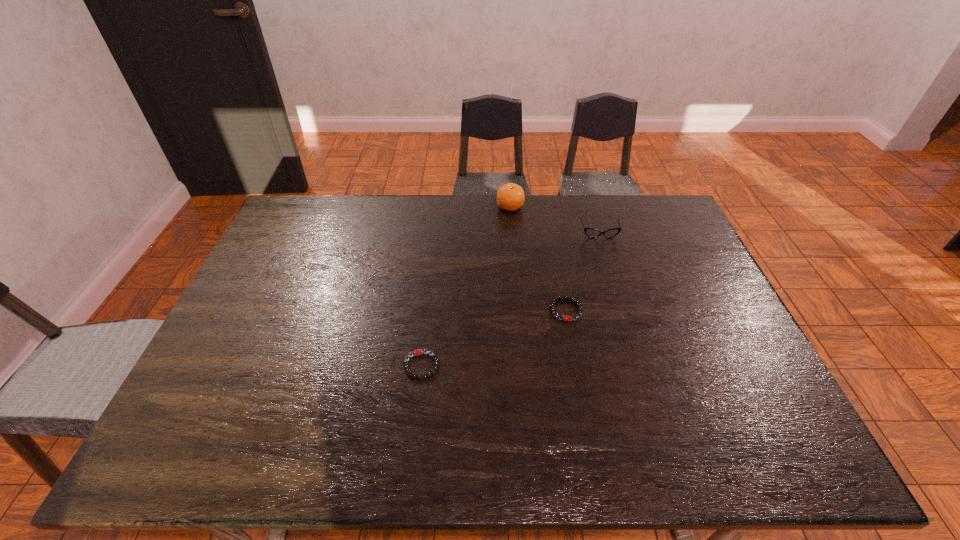
Locate an element on the screen. The image size is (960, 540). vacant space that's between the farthest object and the farther bracelet is located at coordinates (538, 258).

The image size is (960, 540). I want to click on free space between the nearest object and the tallest object, so click(466, 286).

At what (x,y) coordinates should I click in order to perform the action: click on vacant space that's between the farthest object and the spectacles. Please return your answer as a coordinate pair (x, y). This screenshot has width=960, height=540. Looking at the image, I should click on (555, 220).

I want to click on free spot between the right bracelet and the left bracelet, so click(x=493, y=338).

Image resolution: width=960 pixels, height=540 pixels. What are the coordinates of `free point between the second nearest object and the left bracelet` in the screenshot? It's located at (493, 338).

Identify the location of free space between the left bracelet and the second tallest object. The height and width of the screenshot is (540, 960). (511, 299).

The image size is (960, 540). What are the coordinates of `vacant region between the third object from right to left and the leftmost object` in the screenshot? It's located at (466, 286).

You are a GUI agent. You are given a task and a screenshot of the screen. Output one action in this format:
    pyautogui.click(x=<x>, y=<y>)
    Task: Click on the vacant space in between the nearer bracelet and the farther bracelet
    
    Given the screenshot: What is the action you would take?
    pyautogui.click(x=493, y=338)

At what (x,y) coordinates should I click in order to perform the action: click on free space between the left bracelet and the right bracelet. Please return your answer as a coordinate pair (x, y). The height and width of the screenshot is (540, 960). Looking at the image, I should click on (493, 338).

In order to click on vacant space in between the clementine and the third farthest object in this screenshot , I will do click(x=538, y=258).